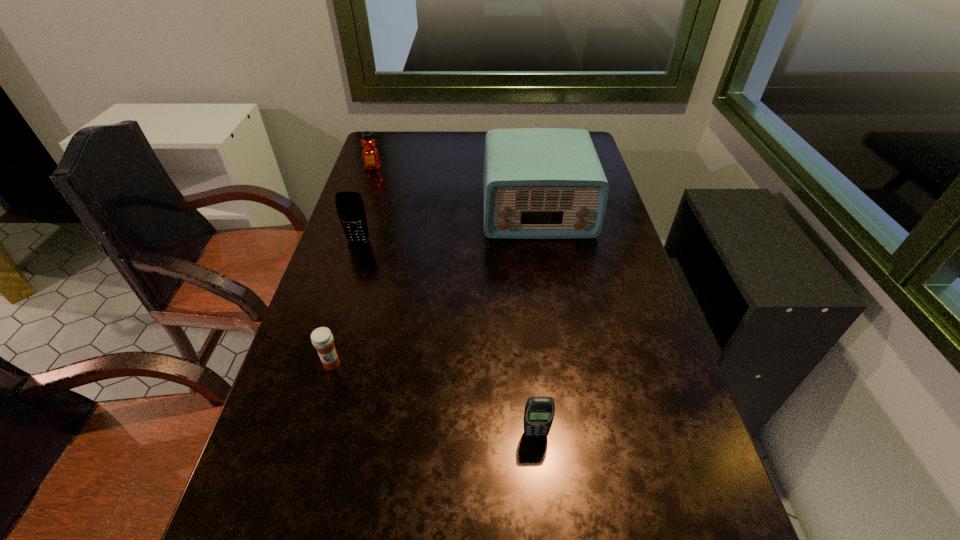
The width and height of the screenshot is (960, 540). In order to click on radio receiver in this screenshot , I will do `click(539, 183)`.

Locate an element on the screen. This screenshot has height=540, width=960. the farther cellular telephone is located at coordinates 350,208.

The height and width of the screenshot is (540, 960). Find the location of `the left cellular telephone`. the left cellular telephone is located at coordinates (350, 208).

Image resolution: width=960 pixels, height=540 pixels. Find the location of `honey`. honey is located at coordinates (370, 156).

Find the location of `the shorter cellular telephone`. the shorter cellular telephone is located at coordinates (539, 412).

I want to click on the nearest object, so click(x=539, y=412).

I want to click on the shortest object, so click(322, 339).

The image size is (960, 540). Identify the location of the second nearest object. (322, 339).

The width and height of the screenshot is (960, 540). I want to click on vacant area situated on the front panel of the radio receiver, so click(552, 299).

Identify the location of free spot located on the screen of the farther cellular telephone. (332, 325).